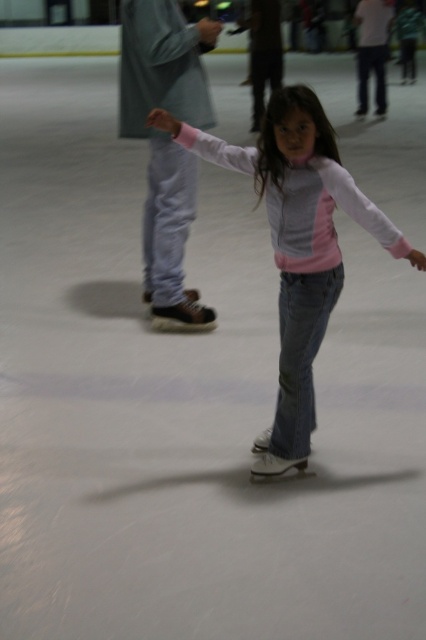
Question: Observing the image, what is the correct spatial positioning of pink matte jacket at center in reference to matte brown skate at left?

Choices:
 (A) left
 (B) right

Answer: (B)

Question: Can you confirm if pink matte jacket at center is positioned to the left of matte brown skate at left?

Choices:
 (A) no
 (B) yes

Answer: (A)

Question: Which point is farther to the camera?

Choices:
 (A) matte brown skate at left
 (B) pink matte jacket at center

Answer: (A)

Question: Which point is closer to the camera taking this photo?

Choices:
 (A) (158, 120)
 (B) (155, 32)

Answer: (A)

Question: Does pink matte jacket at center appear on the right side of matte brown skate at left?

Choices:
 (A) no
 (B) yes

Answer: (B)